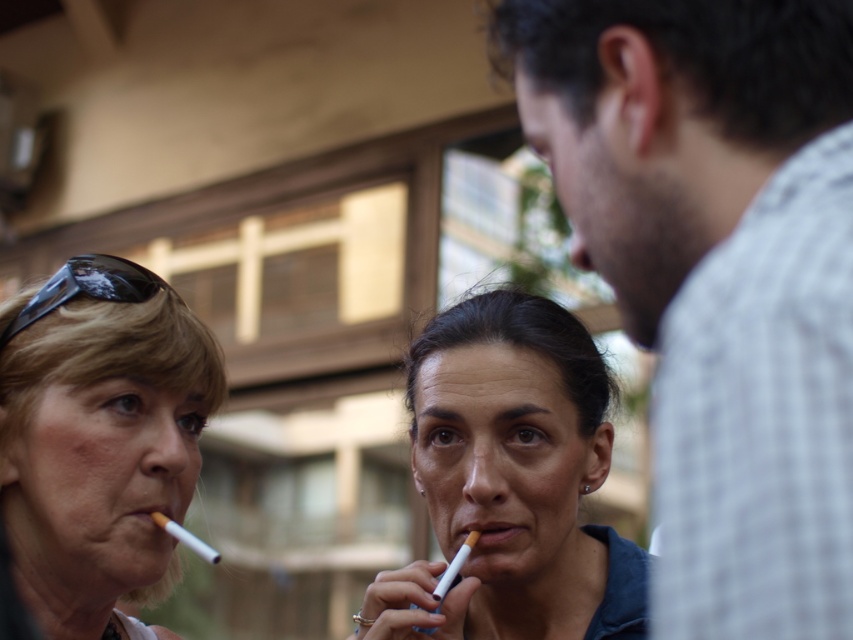
Question: Which point is farther to the camera?

Choices:
 (A) matte black sunglasses at upper left
 (B) white matte cigarette at lower left
 (C) white checkered shirt at right
 (D) matte blue cigarette at center

Answer: (B)

Question: Which point is closer to the camera?

Choices:
 (A) (32, 384)
 (B) (219, 557)
 (C) (537, 596)
 (D) (461, 561)

Answer: (D)

Question: Which object is the farthest from the white checkered shirt at right?

Choices:
 (A) white matte cigarette at lower left
 (B) white matte cigarette at center
 (C) matte black sunglasses at upper left
 (D) matte blue cigarette at center

Answer: (A)

Question: Does white checkered shirt at right lie behind white matte cigarette at center?

Choices:
 (A) no
 (B) yes

Answer: (A)

Question: Does white checkered shirt at right have a lesser width compared to white matte cigarette at lower left?

Choices:
 (A) no
 (B) yes

Answer: (A)

Question: Is matte black sunglasses at upper left bigger than matte blue cigarette at center?

Choices:
 (A) no
 (B) yes

Answer: (A)